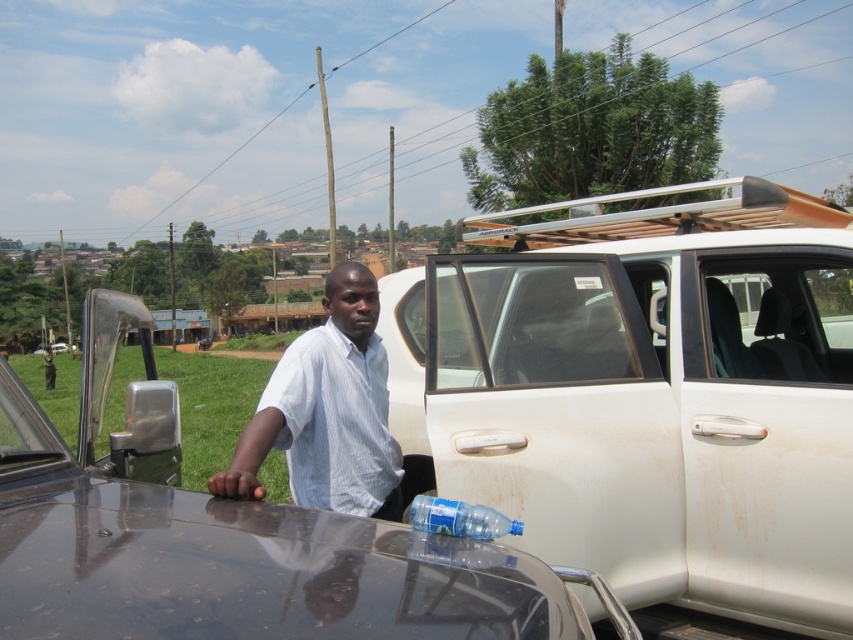
Question: Is white matte car at center behind white striped shirt at center?

Choices:
 (A) no
 (B) yes

Answer: (A)

Question: Which object appears closest to the camera in this image?

Choices:
 (A) white matte van at center
 (B) white matte car at center
 (C) translucent blue plastic bottle at lower center

Answer: (B)

Question: Is the position of white matte van at center more distant than that of translucent blue plastic bottle at lower center?

Choices:
 (A) no
 (B) yes

Answer: (B)

Question: Among these objects, which one is farthest from the camera?

Choices:
 (A) white matte van at center
 (B) translucent blue plastic bottle at lower center

Answer: (A)

Question: Which point is farther from the camera taking this photo?

Choices:
 (A) (444, 512)
 (B) (372, 449)
 (C) (399, 627)

Answer: (B)

Question: Does white matte car at center appear under translucent blue plastic bottle at lower center?

Choices:
 (A) yes
 (B) no

Answer: (A)